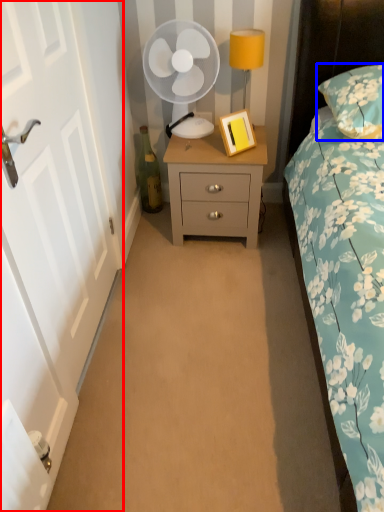
Question: Which object appears closest to the camera in this image, door (highlighted by a red box) or pillow (highlighted by a blue box)?

Choices:
 (A) door
 (B) pillow

Answer: (A)